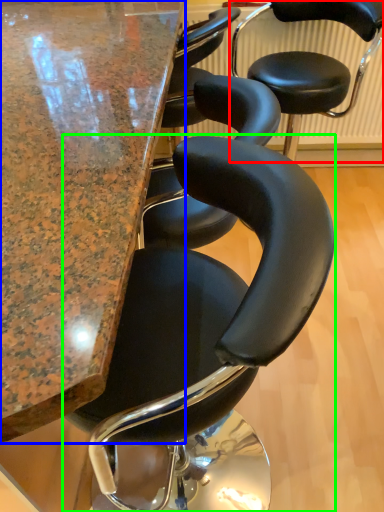
Question: Based on their relative distances, which object is farther from chair (highlighted by a red box)? Choose from table (highlighted by a blue box) and chair (highlighted by a green box).

Choices:
 (A) table
 (B) chair

Answer: (B)